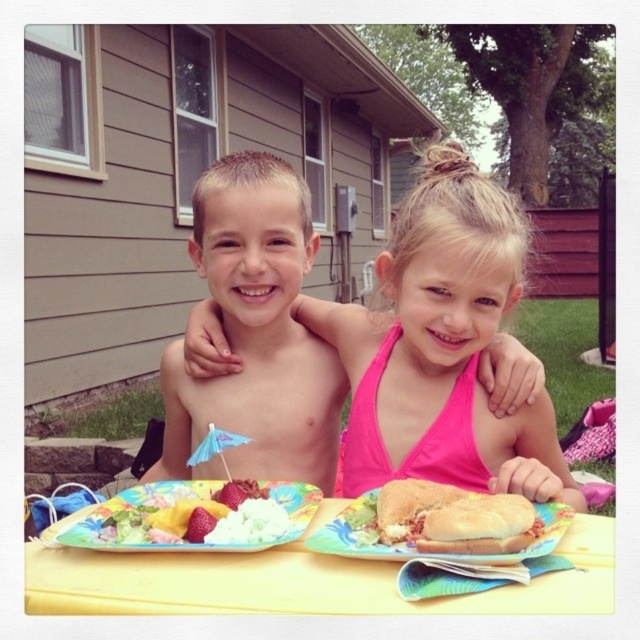
Describe the element at coordinates (298, 582) in the screenshot. I see `yellow plastic table at center` at that location.

Find the location of `yellow plastic table at center`. yellow plastic table at center is located at coordinates (298, 582).

Can you confirm if matte paper plate at center is taller than strawberrysmoothfruit at center?

Yes.

Is matte paper plate at center wider than strawberrysmoothfruit at center?

Yes.

This screenshot has width=640, height=640. I want to click on matte paper plate at center, so click(429, 552).

Find the location of a particular element. This screenshot has width=640, height=640. matte paper plate at center is located at coordinates (429, 552).

Who is more forward, (488, 522) or (188, 524)?

Positioned in front is point (488, 522).

Is point (464, 532) in front of point (205, 516)?

Yes.

Is point (424, 541) more distant than point (186, 531)?

No, it is in front of (186, 531).

Where is `white bread sandwich at center`? Image resolution: width=640 pixels, height=640 pixels. white bread sandwich at center is located at coordinates (477, 525).